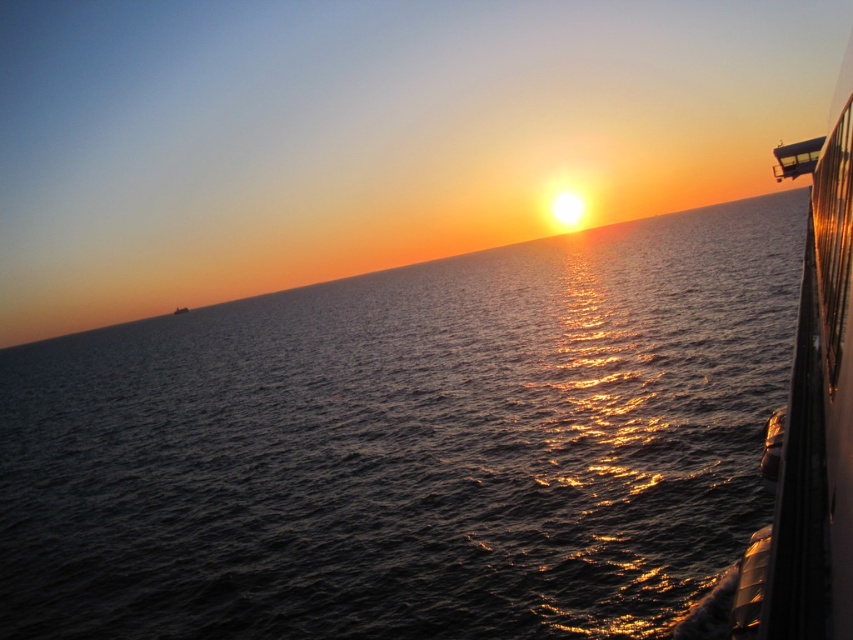
Is dark blue water at center in front of white glossy boat at right?

That is False.

Does dark blue water at center come behind white glossy boat at right?

Yes, it is behind white glossy boat at right.

Between point (669, 518) and point (827, 198), which one is positioned behind?

Point (669, 518)

The width and height of the screenshot is (853, 640). In order to click on dark blue water at center in this screenshot , I will do `click(410, 445)`.